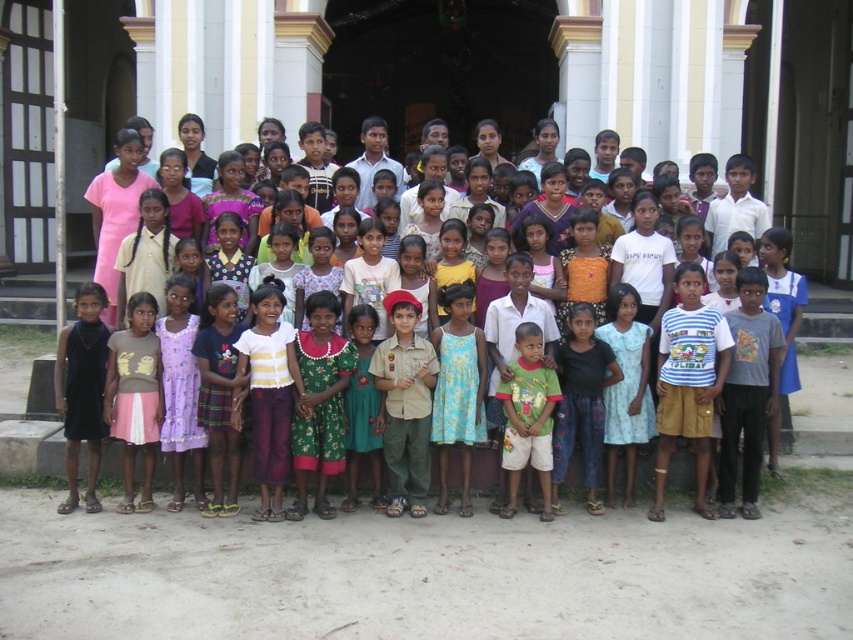
Can you confirm if green dress at center is shorter than green cotton shirt at center?

No, green dress at center is not shorter than green cotton shirt at center.

Can you confirm if green dress at center is thinner than green cotton shirt at center?

No, green dress at center is not thinner than green cotton shirt at center.

Is point (527, 236) closer to camera compared to point (535, 346)?

No, (527, 236) is further to viewer.

This screenshot has height=640, width=853. Identify the location of green dress at center. (624, 250).